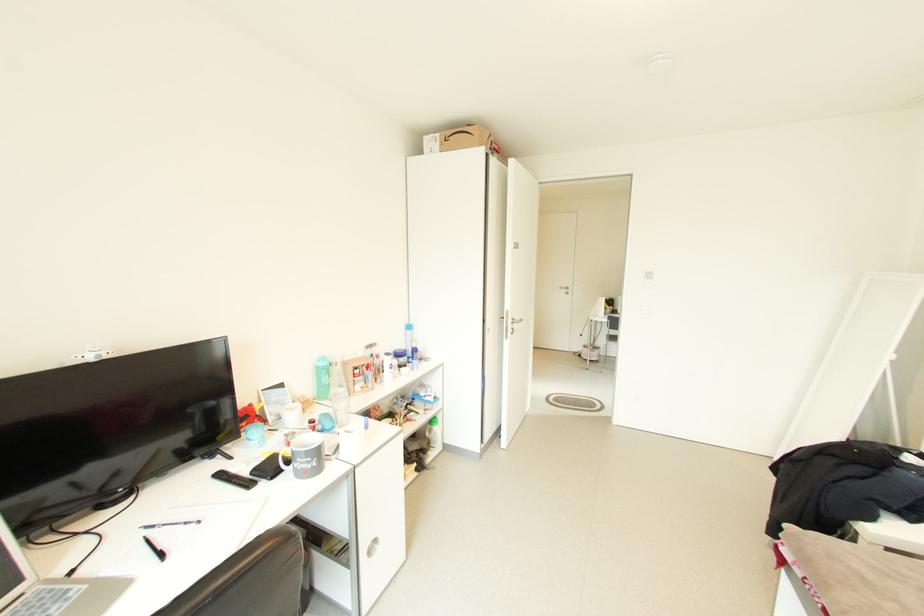
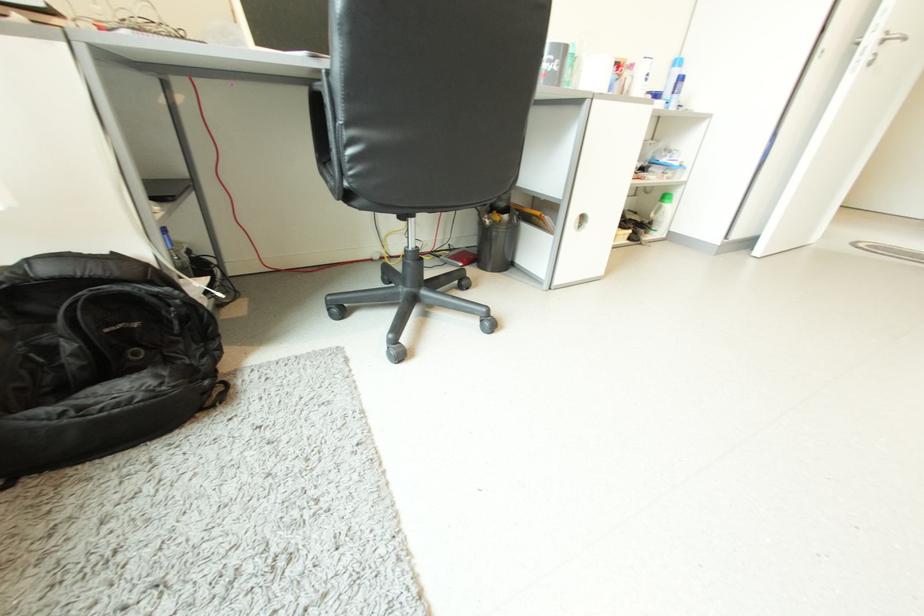
Find the pixel in the second image that matches [518,323] in the first image.

(886, 41)